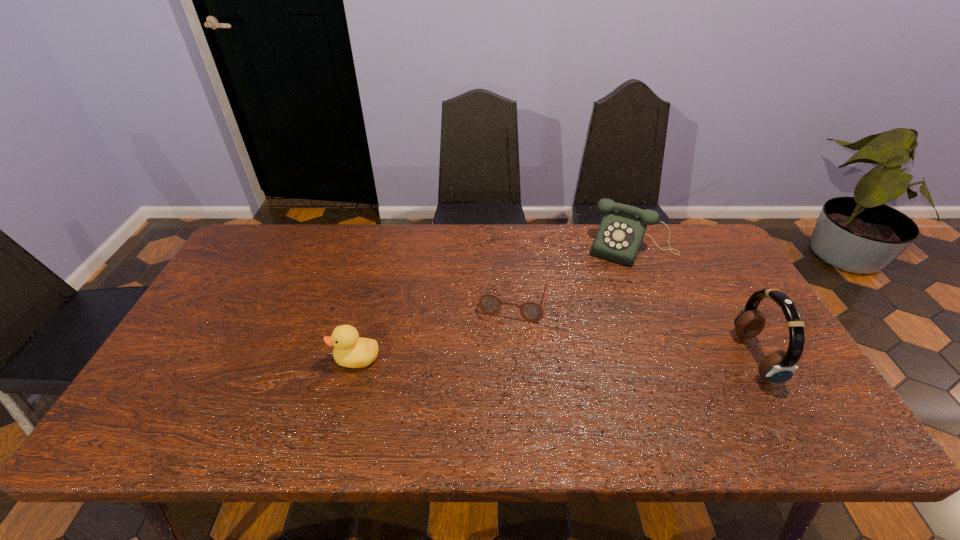
This screenshot has width=960, height=540. In order to click on vacant position located 0.120m on the face of the leftmost object in this screenshot , I will do `click(286, 359)`.

Locate an element on the screen. The image size is (960, 540). vacant space located 0.050m on the ear cup of the headset is located at coordinates (786, 356).

I want to click on free space located on the dial of the farthest object, so click(x=588, y=334).

Image resolution: width=960 pixels, height=540 pixels. Find the location of `free location located on the dial of the farthest object`. free location located on the dial of the farthest object is located at coordinates (590, 329).

Find the location of `vacant space located 0.350m on the dial of the farthest object`. vacant space located 0.350m on the dial of the farthest object is located at coordinates (585, 341).

Locate an element on the screen. Image resolution: width=960 pixels, height=540 pixels. free space located 0.060m on the front-facing side of the third nearest object is located at coordinates (503, 339).

In order to click on vacant space situated on the front-facing side of the third nearest object in this screenshot , I will do point(499,354).

At what (x,y) coordinates should I click in order to perform the action: click on vacant space located 0.160m on the front-facing side of the third nearest object. Please return your answer as a coordinate pair (x, y). Looking at the image, I should click on (495, 369).

This screenshot has width=960, height=540. Find the location of `object at the far edge`. object at the far edge is located at coordinates (620, 234).

Locate an element on the screen. object that is at the near edge is located at coordinates (778, 367).